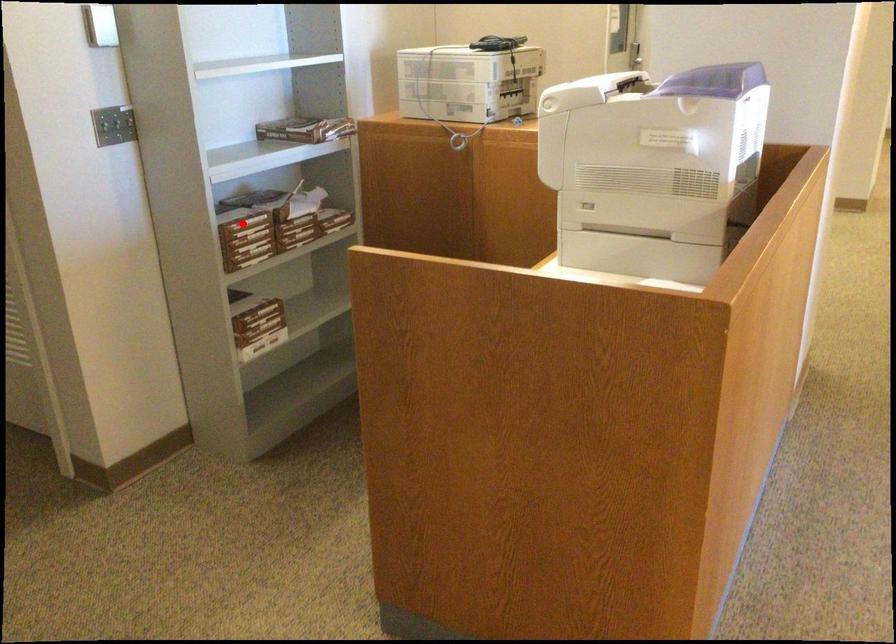
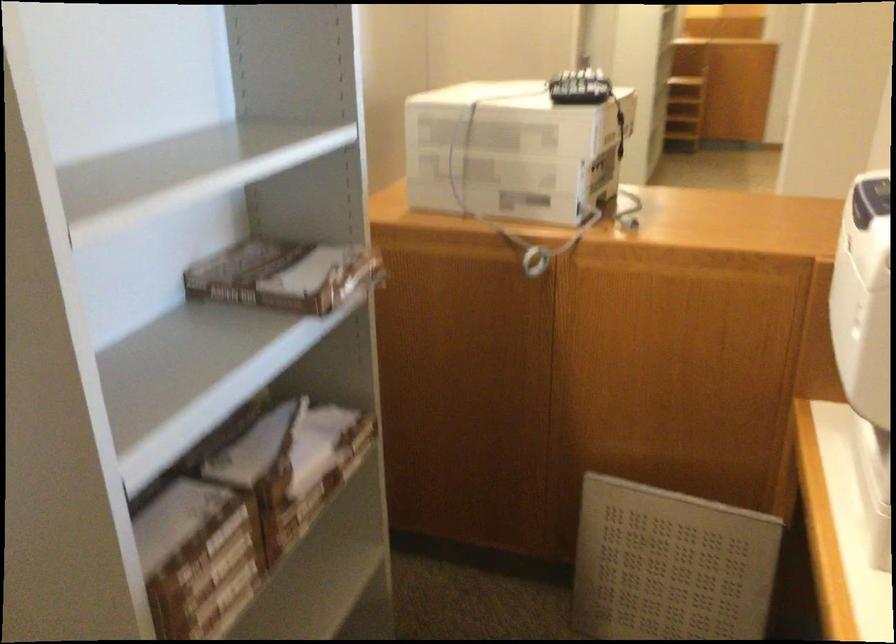
Where in the second image is the point corresponding to the highlighted location from the first image?

(209, 556)